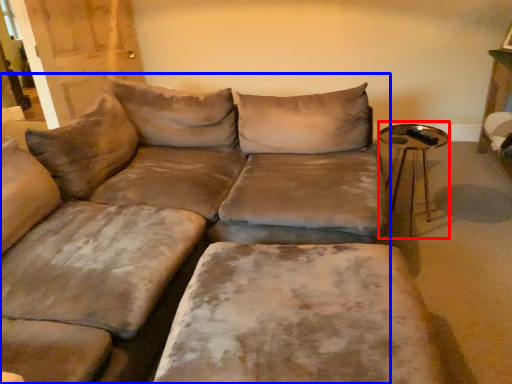
Question: Which point is closer to the camera, side table (highlighted by a red box) or studio couch (highlighted by a blue box)?

Choices:
 (A) side table
 (B) studio couch

Answer: (B)